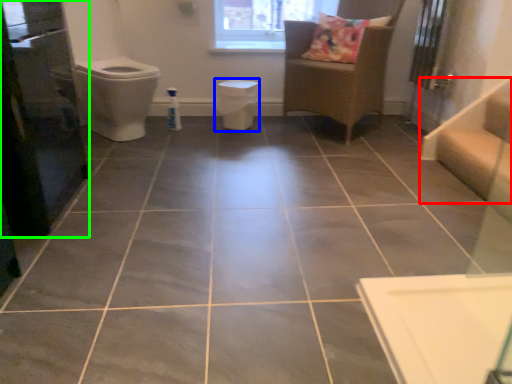
Question: Based on their relative distances, which object is farther from stairwell (highlighted by a red box)? Choose from toilet bowl (highlighted by a blue box) and screen door (highlighted by a green box).

Choices:
 (A) toilet bowl
 (B) screen door

Answer: (B)